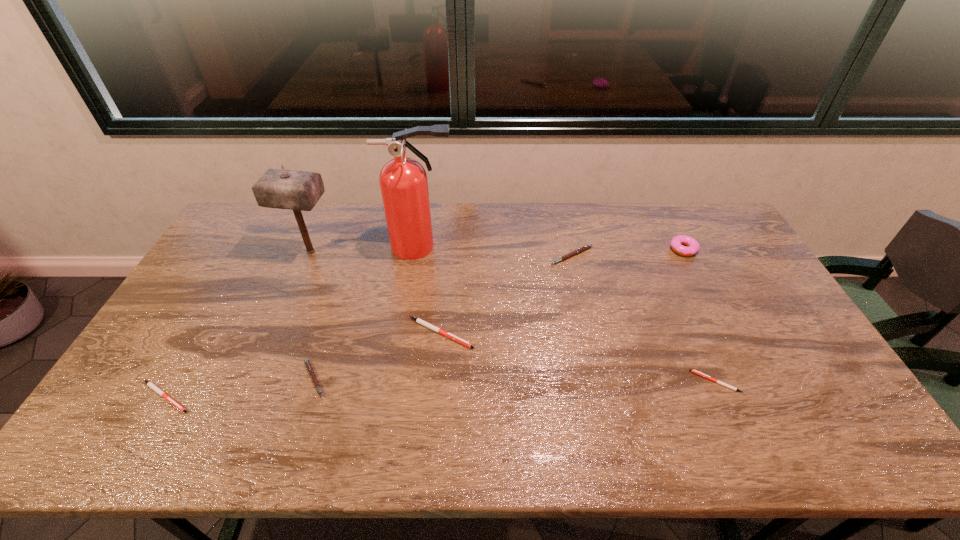
I want to click on the nearer pink pen, so click(309, 367).

Identify the location of the second biggest white pen. (150, 384).

You are a GUI agent. You are given a task and a screenshot of the screen. Output one action in this format:
    pyautogui.click(x=<x>, y=<y>)
    Task: Click on the leftmost pen
    
    Given the screenshot: What is the action you would take?
    pyautogui.click(x=150, y=384)

The height and width of the screenshot is (540, 960). I want to click on the smallest white pen, so click(694, 371).

Where is `the shortest object`? This screenshot has width=960, height=540. the shortest object is located at coordinates 694,371.

Find the location of a particular element. Image resolution: width=960 pixels, height=540 pixels. vacant area located 0.170m on the left of the fire extinguisher is located at coordinates click(338, 247).

This screenshot has width=960, height=540. In order to click on vacant area located on the back of the second object from left to right in this screenshot , I will do `click(320, 231)`.

You are a GUI agent. You are given a task and a screenshot of the screen. Output one action in this format:
    pyautogui.click(x=<x>, y=<y>)
    Task: Click on the vacant space located on the front of the pink doughnut
    
    Given the screenshot: What is the action you would take?
    pyautogui.click(x=710, y=302)

Find the location of a particular element. The width and height of the screenshot is (960, 540). vacant space located 0.070m at the nib of the fourth pen from left to right is located at coordinates (577, 281).

This screenshot has height=540, width=960. What are the coordinates of `vacant space located on the clicker of the second white pen from left to right` in the screenshot? It's located at (548, 333).